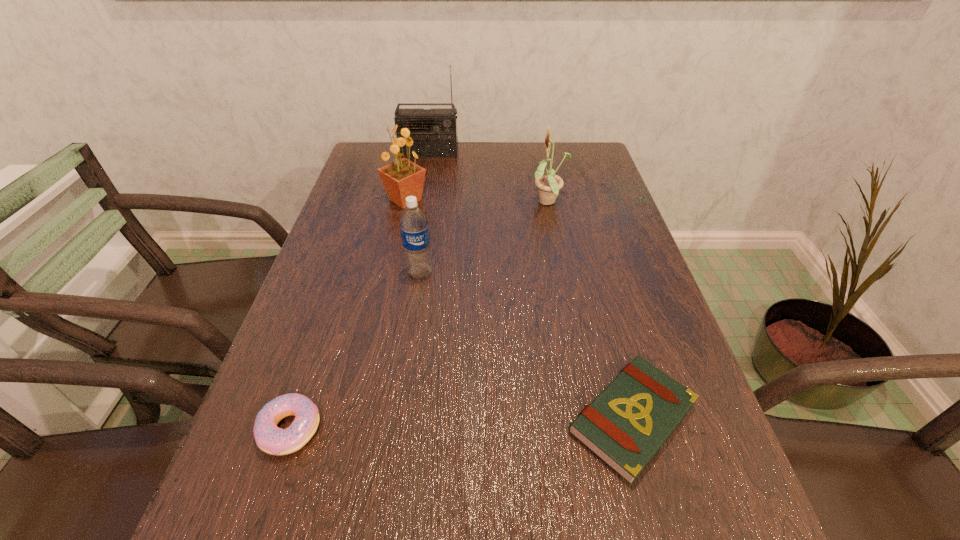
The height and width of the screenshot is (540, 960). Find the location of `vacant point that satisfies the following two spatial constraints: 1. on the front-facing side of the right sunflower; 2. on the back side of the shortest object`. vacant point that satisfies the following two spatial constraints: 1. on the front-facing side of the right sunflower; 2. on the back side of the shortest object is located at coordinates (592, 418).

This screenshot has height=540, width=960. I want to click on vacant space that satisfies the following two spatial constraints: 1. on the front panel of the book; 2. on the right side of the radio receiver, so click(382, 418).

Where is `free space that satisfies the following two spatial constraints: 1. on the front panel of the farthest object; 2. at the front of the left sunflower with flowers visible`? free space that satisfies the following two spatial constraints: 1. on the front panel of the farthest object; 2. at the front of the left sunflower with flowers visible is located at coordinates (421, 200).

This screenshot has width=960, height=540. I want to click on free space that satisfies the following two spatial constraints: 1. at the front of the fourth farthest object with flowers visible; 2. on the left side of the left sunflower, so click(x=389, y=273).